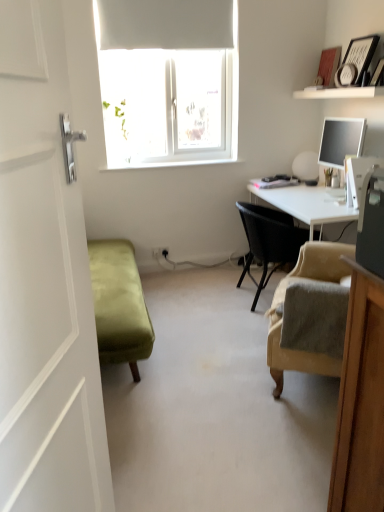
Measure the distance between point [300,153] and camera.

Point [300,153] and camera are 3.64 meters apart from each other.

This screenshot has height=512, width=384. I want to click on white matte shelf at upper right, so click(339, 92).

What do you see at coordinates (46, 303) in the screenshot? I see `white glossy door handle at left` at bounding box center [46, 303].

Locate an element on the screen. Image resolution: width=384 pixels, height=512 pixels. beige fabric armchair at lower right, the 1th chair viewed from the front is located at coordinates (310, 314).

Can you confirm if white matte table lamp at right is wider than white glossy door handle at left?

Yes.

From a real-world perspective, who is located higher, white matte table lamp at right or white glossy door handle at left?

white matte table lamp at right.

Is point (303, 157) positioned after point (64, 327)?

Yes.

Does white matte table lamp at right have a larger size compared to white glossy door handle at left?

No.

Is the depth of black woven chair at center, acting as the first chair starting from the back, greater than that of white matte table lamp at right?

No, it is not.

Is white matte table lamp at right located within black woven chair at center, acting as the first chair starting from the back?

No.

Locate an element on the screen. This screenshot has height=512, width=384. chair that is the 1st one when counting leftward from the white matte table lamp at right is located at coordinates (269, 241).

Can you tell me how much black woven chair at center, arranged as the second chair when viewed from the front, and white matte table lamp at right differ in facing direction?

The facing directions of black woven chair at center, arranged as the second chair when viewed from the front, and white matte table lamp at right are 178 degrees apart.

Considering the sizes of white glossy door handle at left and black woven chair at center, acting as the first chair starting from the back, in the image, is white glossy door handle at left bigger or smaller than black woven chair at center, acting as the first chair starting from the back,?

In the image, white glossy door handle at left appears to be smaller than black woven chair at center, acting as the first chair starting from the back.

Is white glossy door handle at left positioned far away from black woven chair at center, acting as the first chair starting from the back?

Yes.

Is white glossy door handle at left taller or shorter than black woven chair at center, arranged as the second chair when viewed from the front?

white glossy door handle at left is taller than black woven chair at center, arranged as the second chair when viewed from the front.

From the image's perspective, between white glossy door handle at left and black woven chair at center, acting as the first chair starting from the back, who is located below?

white glossy door handle at left, from the image's perspective.

Image resolution: width=384 pixels, height=512 pixels. Identify the location of chair behind the white matte shelf at upper right. (269, 241).

Is white matte shelf at upper right in front of or behind black woven chair at center, acting as the first chair starting from the back, in the image?

Visually, white matte shelf at upper right is located in front of black woven chair at center, acting as the first chair starting from the back.

Does point (323, 95) come farther from viewer compared to point (265, 249)?

Yes, it is.

Which is correct: white matte shelf at upper right is inside black woven chair at center, arranged as the second chair when viewed from the front, or outside of it?

The correct answer is: outside.

Which of these two, white glossy door handle at left or white matte shelf at upper right, is thinner?

white glossy door handle at left.

Is white glossy door handle at left not close to white matte shelf at upper right?

white glossy door handle at left is positioned a significant distance from white matte shelf at upper right.

Which of these two, white glossy door handle at left or white matte shelf at upper right, stands taller?

white glossy door handle at left.

Measure the distance between white glossy door handle at left and white matte shelf at upper right.

A distance of 8.23 feet exists between white glossy door handle at left and white matte shelf at upper right.

Does white glossy door handle at left have a greater width compared to beige fabric armchair at lower right, the second chair positioned from the back?

No, white glossy door handle at left is not wider than beige fabric armchair at lower right, the second chair positioned from the back.

Who is bigger, white glossy door handle at left or beige fabric armchair at lower right, the second chair positioned from the back?

white glossy door handle at left.

Which is in front, point (42, 336) or point (304, 292)?

Positioned in front is point (42, 336).

Looking at this image, between white glossy door handle at left and beige fabric armchair at lower right, the second chair positioned from the back, which one has more height?

white glossy door handle at left is taller.

Between beige fabric armchair at lower right, the 1th chair viewed from the front, and white matte table lamp at right, which one is positioned in front?

beige fabric armchair at lower right, the 1th chair viewed from the front, is in front.

Between beige fabric armchair at lower right, the 1th chair viewed from the front, and white matte table lamp at right, which one appears on the right side from the viewer's perspective?

white matte table lamp at right.

Is beige fabric armchair at lower right, the 1th chair viewed from the front, taller or shorter than white matte table lamp at right?

Considering their sizes, beige fabric armchair at lower right, the 1th chair viewed from the front, has more height than white matte table lamp at right.

Is beige fabric armchair at lower right, the second chair positioned from the back, not close to white matte table lamp at right?

Yes, beige fabric armchair at lower right, the second chair positioned from the back, and white matte table lamp at right are located far from each other.

The width and height of the screenshot is (384, 512). In order to click on screen door in front of the white matte table lamp at right in this screenshot , I will do `click(46, 303)`.

Where is `the 1st chair to the left when counting from the white matte table lamp at right`? Image resolution: width=384 pixels, height=512 pixels. the 1st chair to the left when counting from the white matte table lamp at right is located at coordinates (269, 241).

Based on their spatial positions, is black woven chair at center, arranged as the second chair when viewed from the front, or beige fabric armchair at lower right, the second chair positioned from the back, closer to white glossy door handle at left?

beige fabric armchair at lower right, the second chair positioned from the back, lies closer to white glossy door handle at left than the other object.

Considering their positions, is black woven chair at center, acting as the first chair starting from the back, positioned closer to white glossy door handle at left than white matte table lamp at right?

black woven chair at center, acting as the first chair starting from the back, lies closer to white glossy door handle at left than the other object.

From the image, which object appears to be nearer to beige fabric armchair at lower right, the second chair positioned from the back, white glossy door handle at left or black woven chair at center, arranged as the second chair when viewed from the front?

The object closer to beige fabric armchair at lower right, the second chair positioned from the back, is black woven chair at center, arranged as the second chair when viewed from the front.

Estimate the real-world distances between objects in this image. Which object is further from white glossy door handle at left, white matte table lamp at right or black woven chair at center, arranged as the second chair when viewed from the front?

white matte table lamp at right lies further to white glossy door handle at left than the other object.

Estimate the real-world distances between objects in this image. Which object is further from black woven chair at center, acting as the first chair starting from the back, white matte table lamp at right or white glossy door handle at left?

white glossy door handle at left is positioned further to the anchor black woven chair at center, acting as the first chair starting from the back.

Based on their spatial positions, is black woven chair at center, acting as the first chair starting from the back, or white matte table lamp at right closer to beige fabric armchair at lower right, the 1th chair viewed from the front?

black woven chair at center, acting as the first chair starting from the back, is closer to beige fabric armchair at lower right, the 1th chair viewed from the front.

Estimate the real-world distances between objects in this image. Which object is closer to white matte shelf at upper right, white glossy door handle at left or white matte table lamp at right?

white matte table lamp at right.

Based on their spatial positions, is white matte shelf at upper right or white glossy door handle at left further from beige fabric armchair at lower right, the 1th chair viewed from the front?

white matte shelf at upper right lies further to beige fabric armchair at lower right, the 1th chair viewed from the front, than the other object.

At what (x,y) coordinates should I click in order to perform the action: click on chair positioned between white glossy door handle at left and black woven chair at center, arranged as the second chair when viewed from the front, from near to far. Please return your answer as a coordinate pair (x, y). Looking at the image, I should click on (310, 314).

Locate an element on the screen. This screenshot has width=384, height=512. shelf between beige fabric armchair at lower right, the 1th chair viewed from the front, and white matte table lamp at right in the front-back direction is located at coordinates (339, 92).

At what (x,y) coordinates should I click in order to perform the action: click on chair between white glossy door handle at left and white matte shelf at upper right in the front-back direction. Please return your answer as a coordinate pair (x, y). Looking at the image, I should click on (310, 314).

Where is `shelf between white glossy door handle at left and white matte table lamp at right in the front-back direction`? The width and height of the screenshot is (384, 512). shelf between white glossy door handle at left and white matte table lamp at right in the front-back direction is located at coordinates (339, 92).